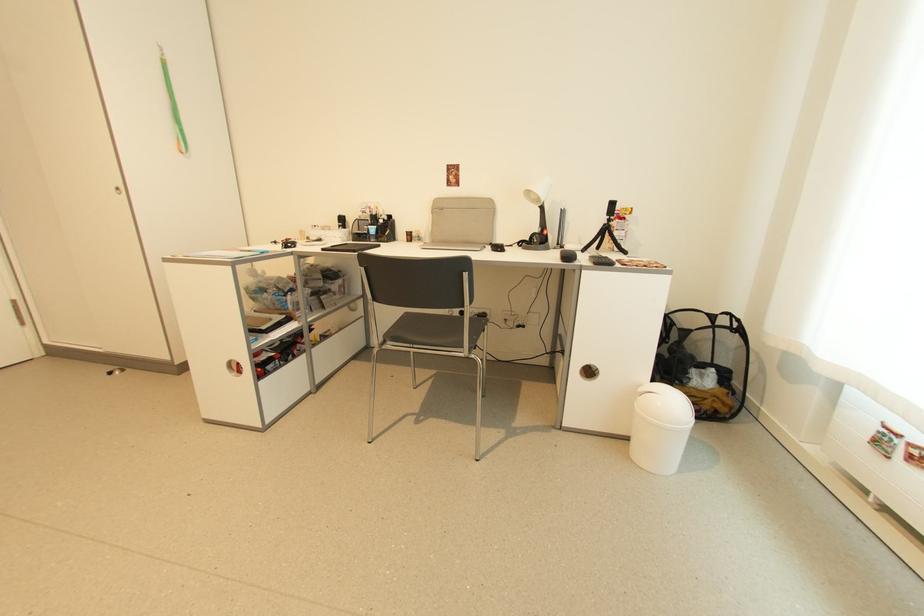
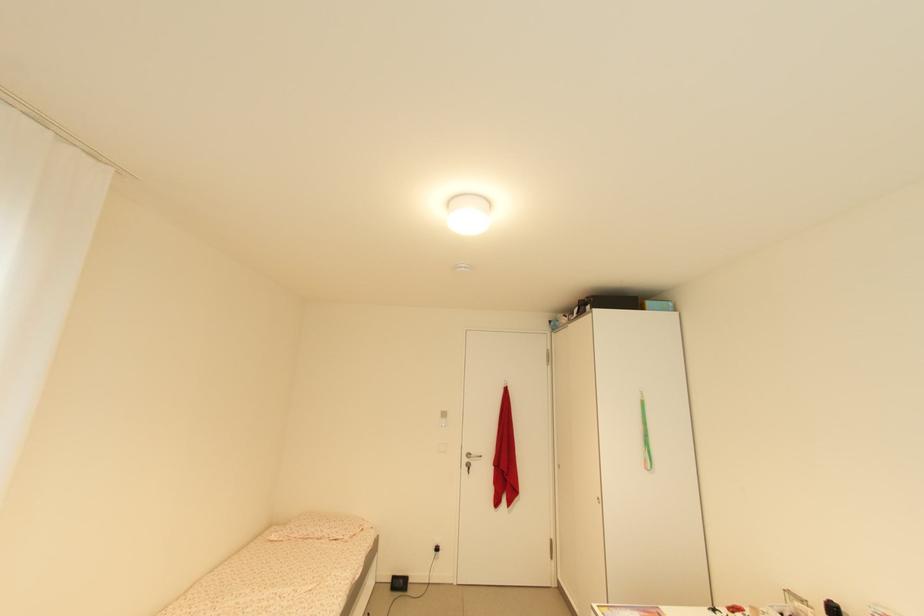
The images are taken continuously from a first-person perspective. In which direction is your viewpoint rotating?

The camera rotated toward left-up.